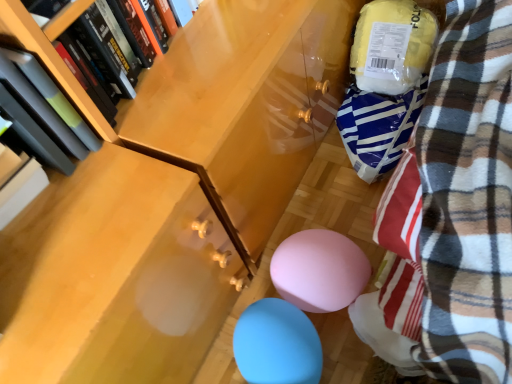
Question: From a real-world perspective, is hardcover book at upper left, the first book when ordered from right to left, over blue rubber balloon at lower center?

Choices:
 (A) no
 (B) yes

Answer: (B)

Question: Is hardcover book at upper left, the first book when ordered from right to left, positioned in front of blue rubber balloon at lower center?

Choices:
 (A) no
 (B) yes

Answer: (B)

Question: Is hardcover book at upper left, the first book when ordered from right to left, wider than blue rubber balloon at lower center?

Choices:
 (A) yes
 (B) no

Answer: (B)

Question: Can you confirm if hardcover book at upper left, the first book when ordered from right to left, is bigger than blue rubber balloon at lower center?

Choices:
 (A) no
 (B) yes

Answer: (A)

Question: Considering the relative positions of hardcover book at upper left, the first book when ordered from right to left, and blue rubber balloon at lower center in the image provided, is hardcover book at upper left, the first book when ordered from right to left, to the left of blue rubber balloon at lower center from the viewer's perspective?

Choices:
 (A) yes
 (B) no

Answer: (A)

Question: Looking at the image, does matte black book at left, the 2th book viewed from the right, seem bigger or smaller compared to blue rubber balloon at lower center?

Choices:
 (A) small
 (B) big

Answer: (A)

Question: Would you say matte black book at left, the 2th book viewed from the right, is to the left or to the right of blue rubber balloon at lower center in the picture?

Choices:
 (A) right
 (B) left

Answer: (B)

Question: Do you think matte black book at left, the 2th book viewed from the right, is within blue rubber balloon at lower center, or outside of it?

Choices:
 (A) outside
 (B) inside

Answer: (A)

Question: From a real-world perspective, relative to blue rubber balloon at lower center, is matte black book at left, the 2th book viewed from the right, vertically above or below?

Choices:
 (A) above
 (B) below

Answer: (A)

Question: Considering their positions, is hardcover book at upper left, which appears as the 2th book when viewed from the left, located in front of or behind blue rubber balloon at lower center?

Choices:
 (A) front
 (B) behind

Answer: (A)

Question: In the image, is hardcover book at upper left, which appears as the 2th book when viewed from the left, on the left side or the right side of blue rubber balloon at lower center?

Choices:
 (A) right
 (B) left

Answer: (B)

Question: Is hardcover book at upper left, the first book when ordered from right to left, situated inside blue rubber balloon at lower center or outside?

Choices:
 (A) outside
 (B) inside

Answer: (A)

Question: From the image's perspective, is hardcover book at upper left, which appears as the 2th book when viewed from the left, located above or below blue rubber balloon at lower center?

Choices:
 (A) below
 (B) above

Answer: (B)

Question: Is point (266, 314) positioned closer to the camera than point (34, 89)?

Choices:
 (A) closer
 (B) farther

Answer: (B)

Question: Considering the positions of blue rubber balloon at lower center and matte black book at left, arranged as the first book when viewed from the left, in the image, is blue rubber balloon at lower center taller or shorter than matte black book at left, arranged as the first book when viewed from the left,?

Choices:
 (A) tall
 (B) short

Answer: (B)